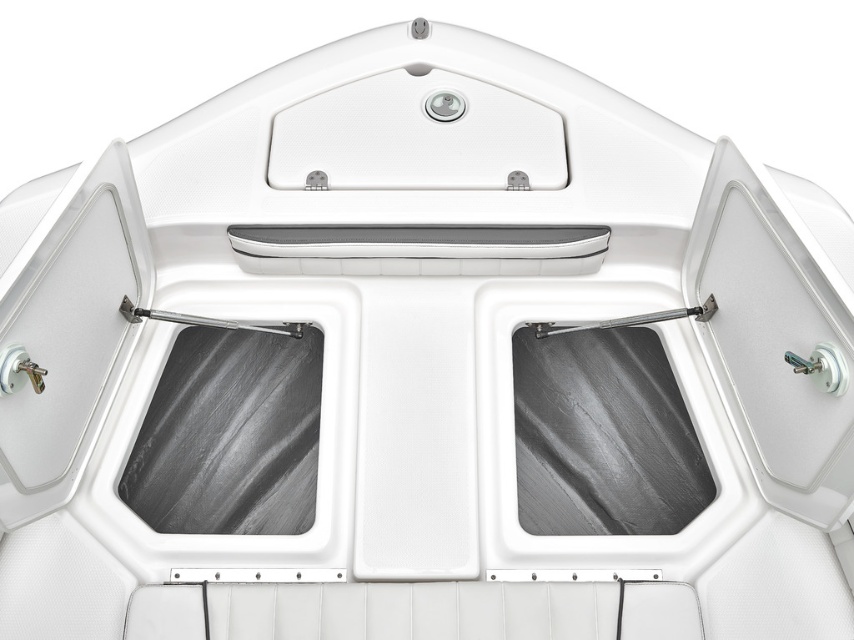
Can you confirm if black textured window at center is positioned below satin black window at center?

No, black textured window at center is not below satin black window at center.

Can you confirm if black textured window at center is positioned above satin black window at center?

Yes, black textured window at center is above satin black window at center.

The width and height of the screenshot is (854, 640). Find the location of `black textured window at center`. black textured window at center is located at coordinates (230, 435).